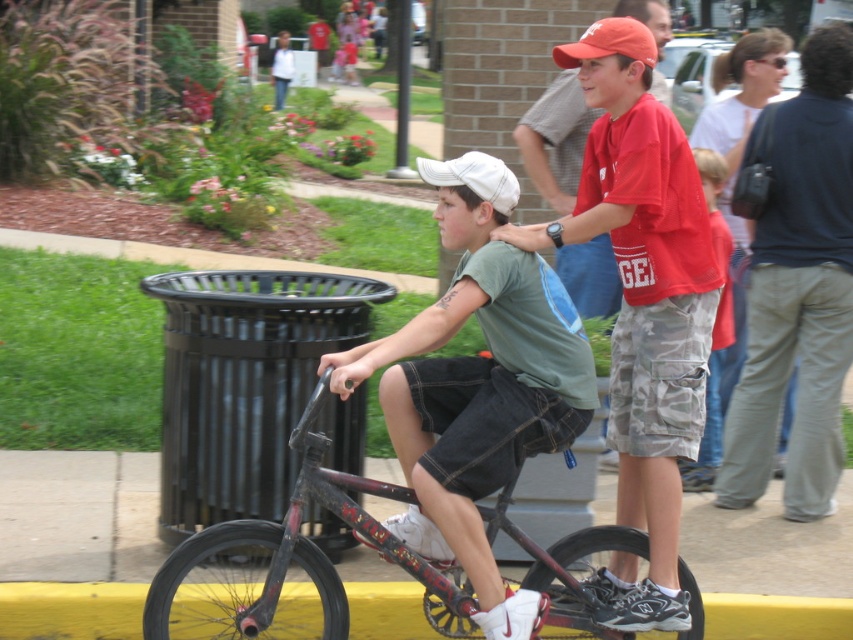
Question: Among these points, which one is nearest to the camera?

Choices:
 (A) (15, 586)
 (B) (711, 236)
 (C) (527, 176)

Answer: (A)

Question: Is dark blue shirt at upper right to the left of yellow rubber curb at lower center from the viewer's perspective?

Choices:
 (A) yes
 (B) no

Answer: (B)

Question: Does red cotton shirt at upper right lie behind orange matte baseball cap at upper center?

Choices:
 (A) yes
 (B) no

Answer: (A)

Question: Considering the relative positions of green cotton shirt at center and yellow rubber curb at lower center in the image provided, where is green cotton shirt at center located with respect to yellow rubber curb at lower center?

Choices:
 (A) below
 (B) above

Answer: (B)

Question: Among these objects, which one is farthest from the camera?

Choices:
 (A) orange matte baseball cap at upper center
 (B) red cotton shirt at center

Answer: (A)

Question: Based on their relative distances, which object is farther from the camouflage shorts at center?

Choices:
 (A) red cotton shirt at center
 (B) orange matte baseball cap at upper center

Answer: (B)